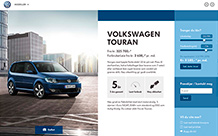
Find the location of a particular element. lights is located at coordinates (51, 79), (78, 80).